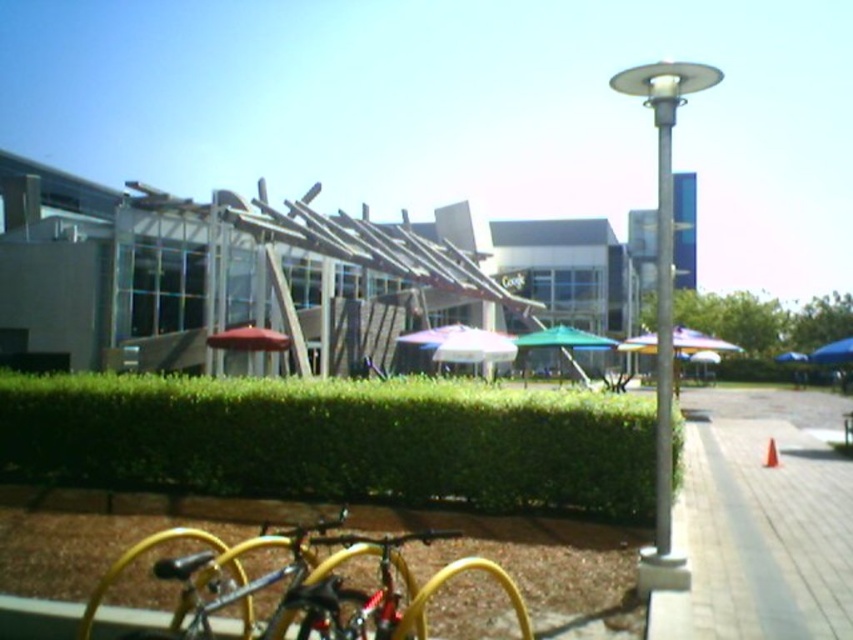
You are standing at the camera position looking at the outdoor scene. There is a point at coordinates point (358,468). Can you tell me how far this point is from your current position?

The point at coordinates point (358,468) is 8.15 meters away from the camera position.

You are a delivery person who needs to park your yellow matte bicycle at lower left on the gray concrete pavement at lower right. Can you park it there without moving the bicycle?

The gray concrete pavement at lower right is positioned under yellow matte bicycle at lower left, so the bicycle is already parked on the pavement. No need to move it.